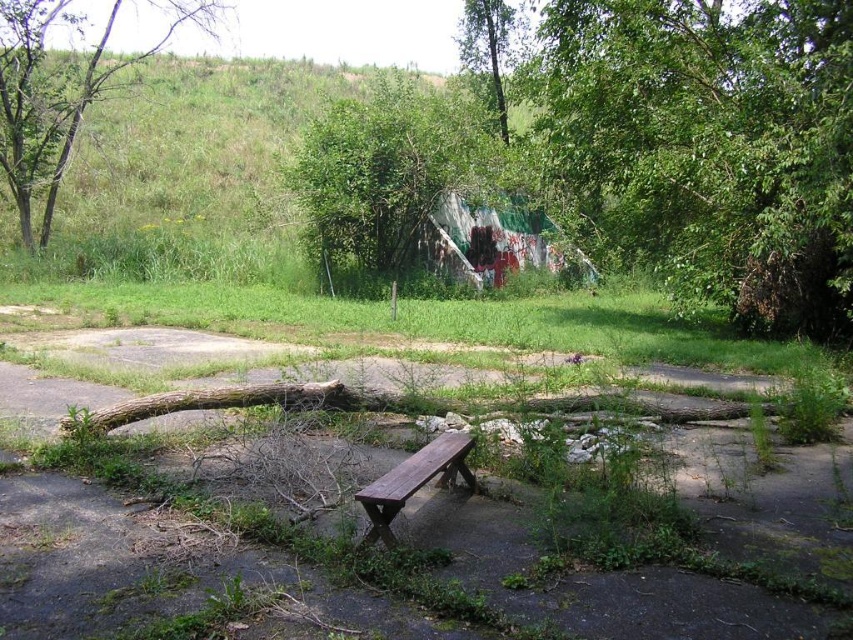
Is wooden bench at center wider than green leafy tree at upper left?

In fact, wooden bench at center might be narrower than green leafy tree at upper left.

Between point (155, 339) and point (84, 22), which one is positioned in front?

Point (155, 339) is in front.

At what (x,y) coordinates should I click in order to perform the action: click on wooden bench at center. Please return your answer as a coordinate pair (x, y). Image resolution: width=853 pixels, height=640 pixels. Looking at the image, I should click on (592, 579).

Is green leafy tree at upper right further to camera compared to green leafy tree at upper center?

No, green leafy tree at upper right is in front of green leafy tree at upper center.

Which is behind, point (730, 106) or point (488, 20)?

Point (488, 20)

Image resolution: width=853 pixels, height=640 pixels. In order to click on green leafy tree at upper right in this screenshot , I will do `click(711, 147)`.

Is green leafy tree at upper left wider than green leafy tree at upper center?

Yes, green leafy tree at upper left is wider than green leafy tree at upper center.

Describe the element at coordinates (61, 92) in the screenshot. I see `green leafy tree at upper left` at that location.

Describe the element at coordinates (61, 92) in the screenshot. This screenshot has height=640, width=853. I see `green leafy tree at upper left` at that location.

This screenshot has width=853, height=640. I want to click on green leafy tree at upper left, so click(61, 92).